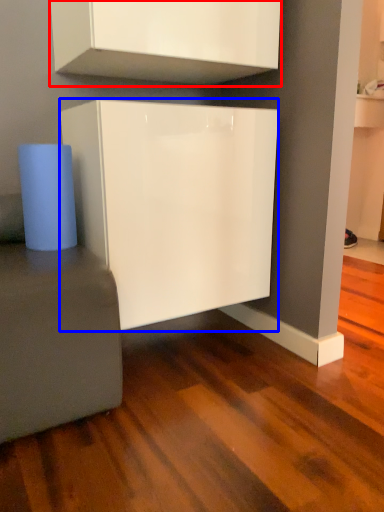
Question: Which of the following is the closest to the observer, cabinetry (highlighted by a red box) or cabinetry (highlighted by a blue box)?

Choices:
 (A) cabinetry
 (B) cabinetry

Answer: (A)